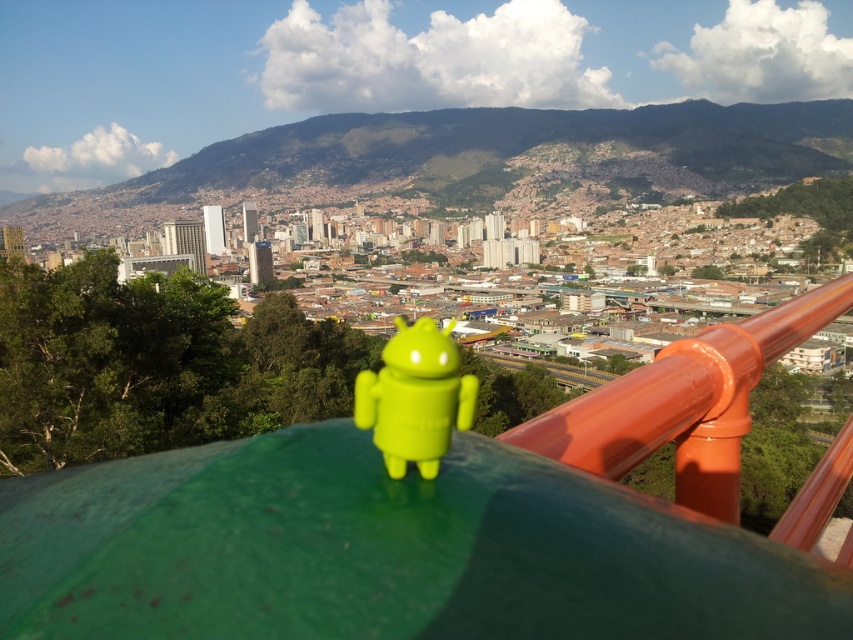
You are a city planner assessing the visibility of landmarks in the image. The orange glossy rail at upper right and the green matte android figure at center are both potential markers. Which of these two objects is bigger in the image?

The orange glossy rail at upper right is larger in size than the green matte android figure at center, so the orange glossy rail at upper right is bigger in the image.

You are a drone operator tasked with delivering a package to the green matte android figure at center. Your drone is currently hovering near the orange glossy rail at upper right. Given that the drone can travel a maximum distance of 500 feet before needing to recharge, will it be able to reach the android figure without needing to recharge?

The orange glossy rail at upper right and green matte android figure at center are 497.01 feet apart. Since the distance is less than the drone maximum travel distance of 500 feet, the drone can reach the green matte android figure at center without needing to recharge.

You are standing at the center of the city and see two points marked on the ground. The first point is labeled as point (704, 348) and the second is point (445, 355). If you want to walk towards the direction of the Android figurine on the green surface, which point should you aim for first?

Point (445, 355) should be aimed for first because it is closer to the observer than point (704, 348), which is behind it.